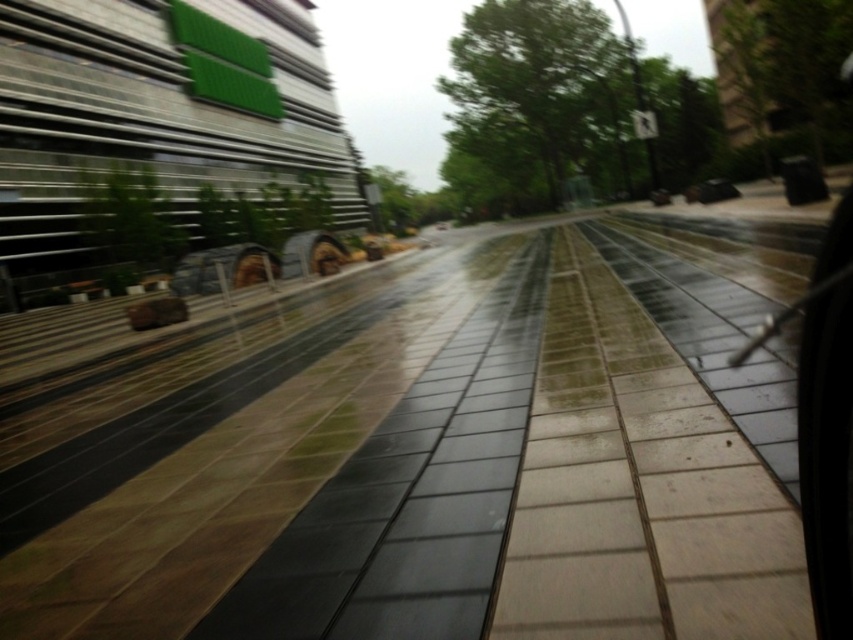
You are standing at the point with coordinates point (320,106) and want to walk towards the point (283,422). According to the scene, will you be moving towards the building or away from it?

Point (283,422) is in front of point (320,106), so moving towards point (283,422) means you are moving towards the building.

You are a pedestrian standing on the shiny concrete pavement at center. You want to board the green glass passenger train at upper left. Which direction should you walk to reach the train?

The shiny concrete pavement at center is located below the green glass passenger train at upper left. So you should walk upwards to reach the train.